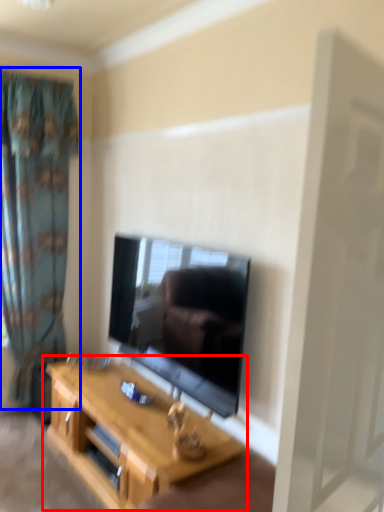
Question: Which of the following is the farthest to the observer, table (highlighted by a red box) or curtain (highlighted by a blue box)?

Choices:
 (A) table
 (B) curtain

Answer: (B)